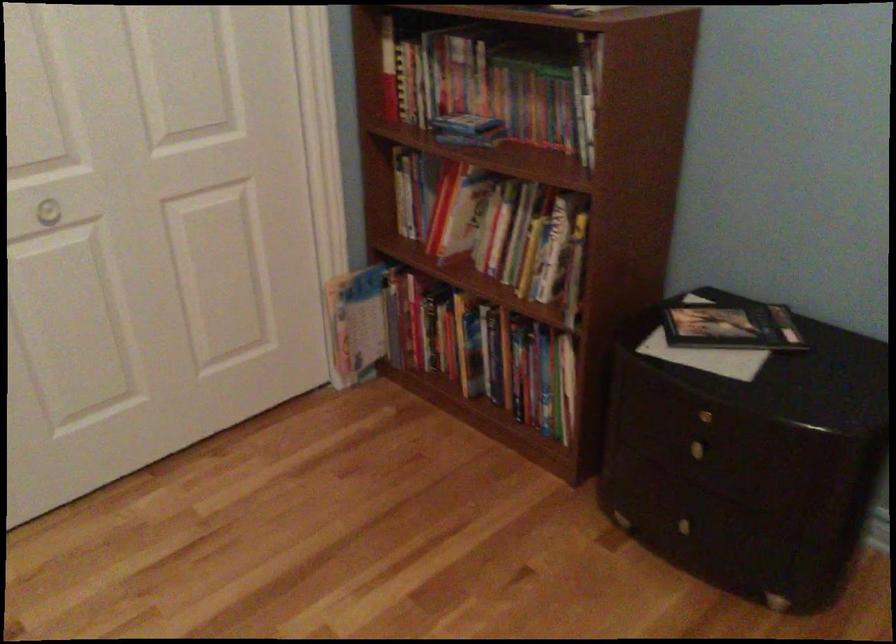
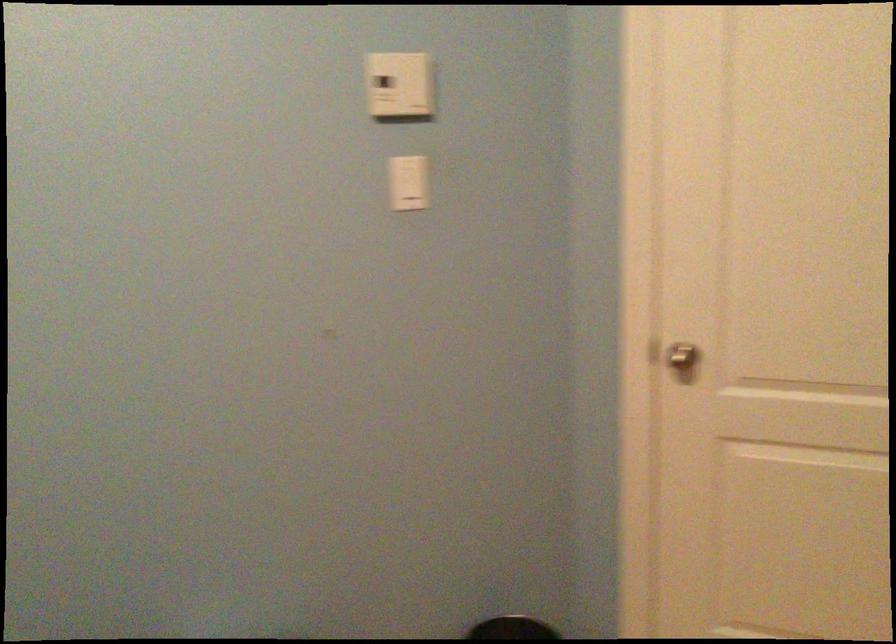
The images are taken continuously from a first-person perspective. In which direction is your viewpoint rotating?

The camera's rotation is toward left-down.